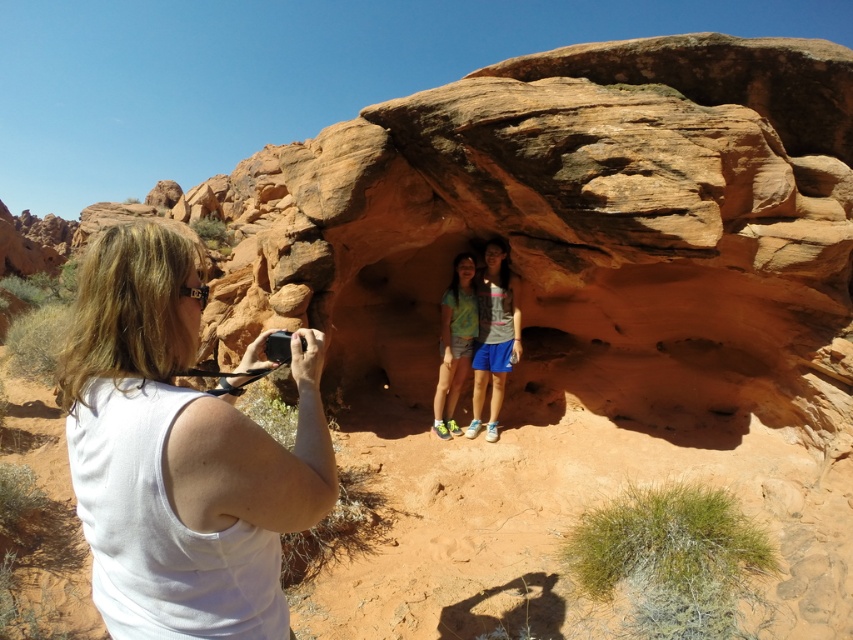
You are a photographer setting up a shoot in the desert. You have two fabrics to use as props. The white fabric at left and the green fabric shirt at center. Based on the scene description, which fabric should you choose if you want the prop to stand out more against the reddish and orange rock formations?

The white fabric at left would stand out more against the reddish and orange rock formations because it has a contrasting color compared to the green fabric shirt at center.

You are standing in the desert scene and want to reach a specific point marked as point (244,605). If your reach extends 1.5 meters, can you touch that point without moving your feet?

The distance of point (244,605) from viewer is 1.63 meters, so you cannot touch it with a reach of 1.5 meters without moving your feet.

You are standing in the desert scene and notice the white fabric at left. Based on its position, can you determine if it is closer to you or further away compared to the rock formation with the two people inside?

The white fabric at left is located at point [178,452], which places it closer to the viewer than the rock formation with the two people inside. Therefore, the white fabric at left is closer to you.